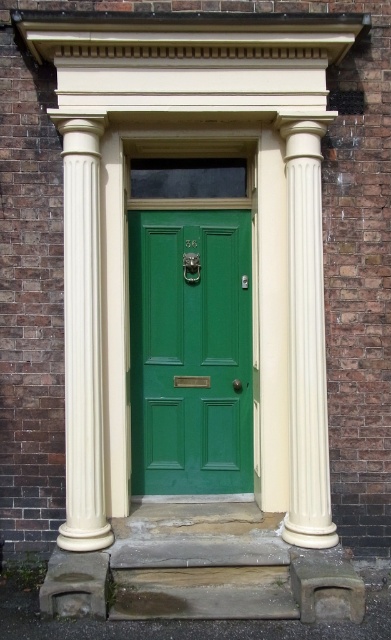
Who is taller, green matte door at center or creamy smooth column at right?

creamy smooth column at right

Does green matte door at center have a smaller size compared to creamy smooth column at right?

Indeed, green matte door at center has a smaller size compared to creamy smooth column at right.

Is point (229, 416) in front of point (321, 129)?

No, it is not.

You are a GUI agent. You are given a task and a screenshot of the screen. Output one action in this format:
    pyautogui.click(x=<x>, y=<y>)
    Task: Click on the green matte door at center
    The image size is (391, 640).
    Given the screenshot: What is the action you would take?
    pyautogui.click(x=190, y=352)

Does green matte door at center have a greater height compared to creamy smooth column at left?

Incorrect, green matte door at center's height is not larger of creamy smooth column at left's.

Who is taller, green matte door at center or creamy smooth column at left?

creamy smooth column at left

Is point (130, 285) positioned before point (96, 436)?

No, it is behind (96, 436).

Identify the location of green matte door at center. (190, 352).

Between point (64, 150) and point (315, 368), which one is positioned behind?

The point (315, 368) is more distant.

Does creamy smooth column at left have a greater width compared to creamy smooth column at right?

Indeed, creamy smooth column at left has a greater width compared to creamy smooth column at right.

I want to click on creamy smooth column at left, so click(x=82, y=337).

Locate an element on the screen. creamy smooth column at left is located at coordinates (82, 337).